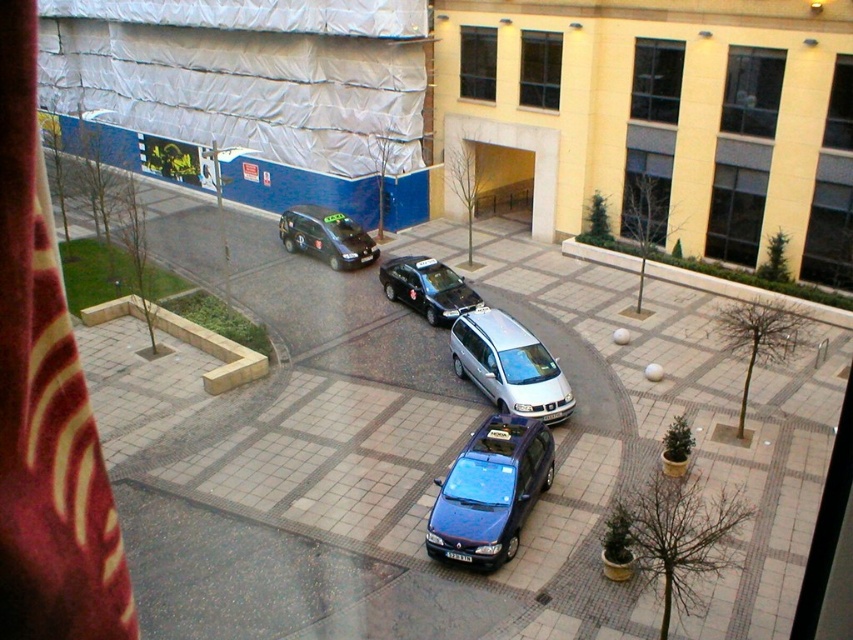
Is metallic silver van at center taller than silver metallic minivan at center?

Correct, metallic silver van at center is much taller as silver metallic minivan at center.

Between point (438, 346) and point (560, 368), which one is positioned behind?

The point (438, 346) is more distant.

In order to click on metallic silver van at center in this screenshot , I will do `click(440, 458)`.

Which is below, glossy blue car at center or shiny black car at center?

glossy blue car at center is below.

Measure the distance from glossy blue car at center to shiny black car at center.

glossy blue car at center is 14.18 meters away from shiny black car at center.

Is point (476, 504) positioned after point (306, 221)?

No.

The image size is (853, 640). What are the coordinates of `glossy blue car at center` in the screenshot? It's located at (490, 492).

Is point (535, 464) positioned in front of point (456, 294)?

Yes, it is.

Is point (454, 499) closer to camera compared to point (451, 317)?

That is True.

The width and height of the screenshot is (853, 640). Find the location of `glossy blue car at center`. glossy blue car at center is located at coordinates (490, 492).